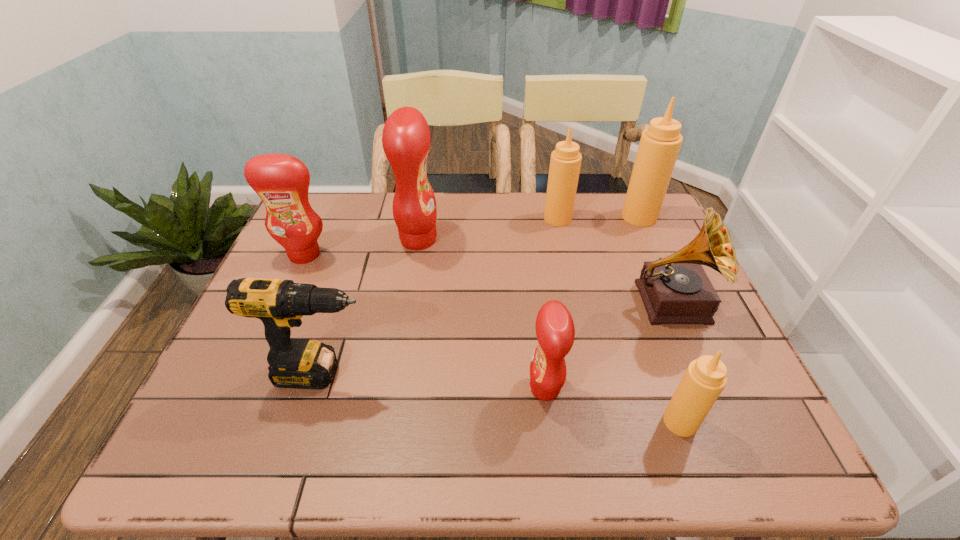
Locate an element on the screen. the second condiment from left to right is located at coordinates (406, 137).

What are the coordinates of `the second red condiment from left to right` in the screenshot? It's located at (406, 137).

At what (x,y) coordinates should I click in order to perform the action: click on the rightmost condiment. Please return your answer as a coordinate pair (x, y). Image resolution: width=960 pixels, height=540 pixels. Looking at the image, I should click on (660, 143).

In order to click on the rightmost tan condiment in this screenshot , I will do `click(660, 143)`.

The image size is (960, 540). What are the coordinates of `the second biggest tan condiment` in the screenshot? It's located at (565, 162).

Where is `the fourth object from right to left`? This screenshot has width=960, height=540. the fourth object from right to left is located at coordinates (565, 162).

This screenshot has height=540, width=960. What are the coordinates of `the leftmost condiment` in the screenshot? It's located at (282, 181).

The image size is (960, 540). Identify the location of the leftmost red condiment. (282, 181).

Where is `the fifth farthest object`? Image resolution: width=960 pixels, height=540 pixels. the fifth farthest object is located at coordinates (675, 290).

Where is `phonograph record`? This screenshot has height=540, width=960. phonograph record is located at coordinates (675, 290).